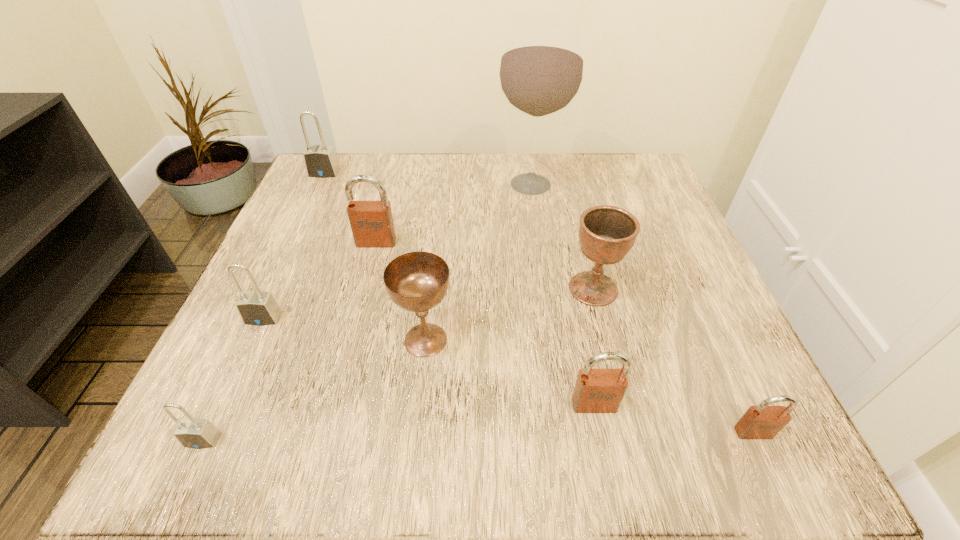
Where is `the second nearest gray padlock`? The image size is (960, 540). the second nearest gray padlock is located at coordinates (259, 308).

Image resolution: width=960 pixels, height=540 pixels. I want to click on the second smallest gray padlock, so click(x=259, y=308).

You are a GUI agent. You are given a task and a screenshot of the screen. Output one action in this format:
    pyautogui.click(x=<x>, y=<y>)
    Task: Click on the second farthest brown padlock
    This screenshot has height=540, width=960.
    Given the screenshot: What is the action you would take?
    pyautogui.click(x=596, y=390)

Find the location of `the third nearest padlock`. the third nearest padlock is located at coordinates (596, 390).

Locate an element on the screen. The width and height of the screenshot is (960, 540). the smallest gray padlock is located at coordinates (194, 433).

Image resolution: width=960 pixels, height=540 pixels. What are the coordinates of `the rightmost object` in the screenshot? It's located at (763, 421).

At what (x,y) coordinates should I click in order to perform the action: click on the smallest brown padlock. Please return your answer as a coordinate pair (x, y). The height and width of the screenshot is (540, 960). Looking at the image, I should click on (763, 421).

I want to click on free space located on the left of the alcohol, so click(393, 184).

What are the coordinates of `vacant space located 0.160m on the shackle of the biggest gray padlock` in the screenshot? It's located at (301, 221).

This screenshot has width=960, height=540. I want to click on vacant space located 0.210m on the front-facing side of the third padlock from right to left, so click(x=352, y=336).